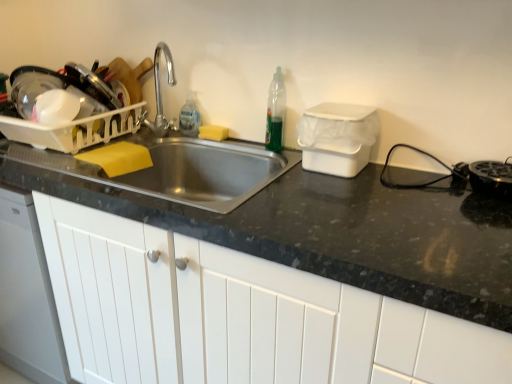
Where is `free spot to the left of black plastic toaster at right, the 1th appliance from the right`? The height and width of the screenshot is (384, 512). free spot to the left of black plastic toaster at right, the 1th appliance from the right is located at coordinates (434, 196).